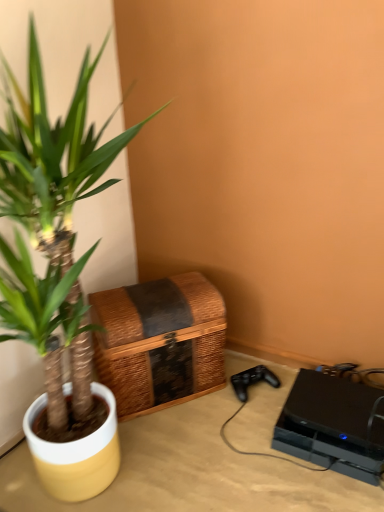
This screenshot has width=384, height=512. In order to click on free space in front of woven brown basket at lower left in this screenshot , I will do `click(176, 453)`.